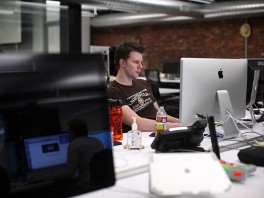
I want to click on cords, so click(x=240, y=122).